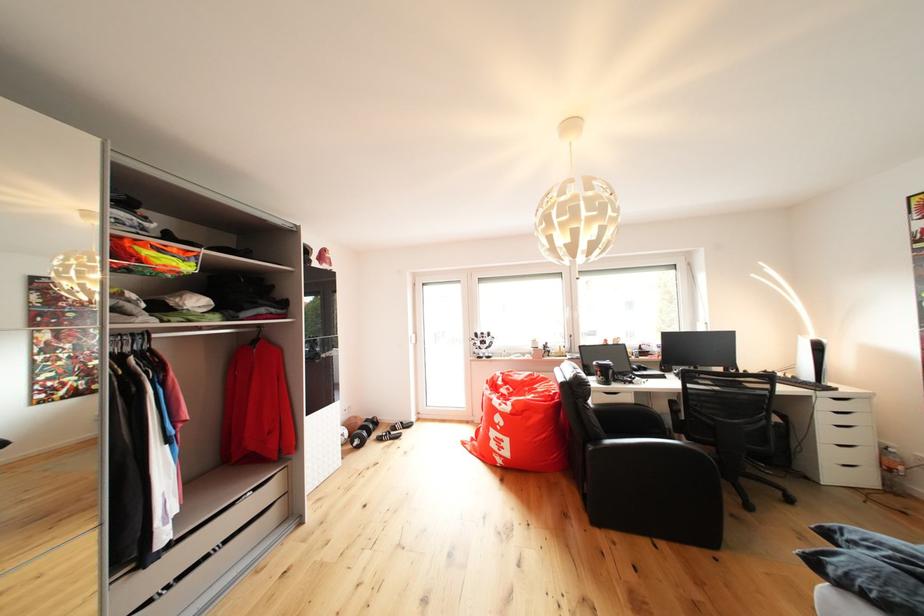
The height and width of the screenshot is (616, 924). Describe the element at coordinates (351, 423) in the screenshot. I see `the basketball` at that location.